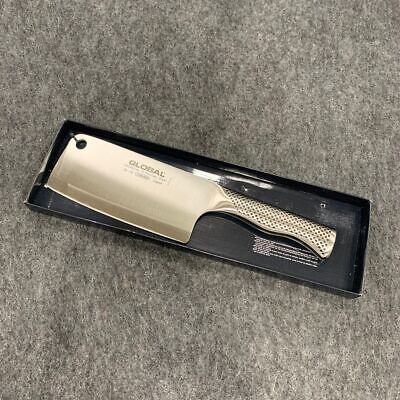
This screenshot has width=400, height=400. I want to click on box, so click(x=231, y=243), click(x=341, y=266), click(x=340, y=214), click(x=58, y=206).